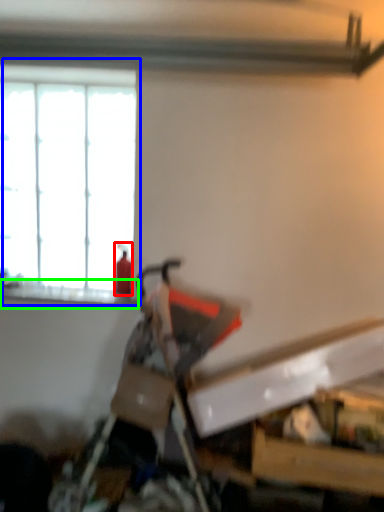
Question: Which object is the farthest from extinguisher (highlighted by a red box)? Choose among these: window (highlighted by a blue box) or window sill (highlighted by a green box).

Choices:
 (A) window
 (B) window sill

Answer: (A)